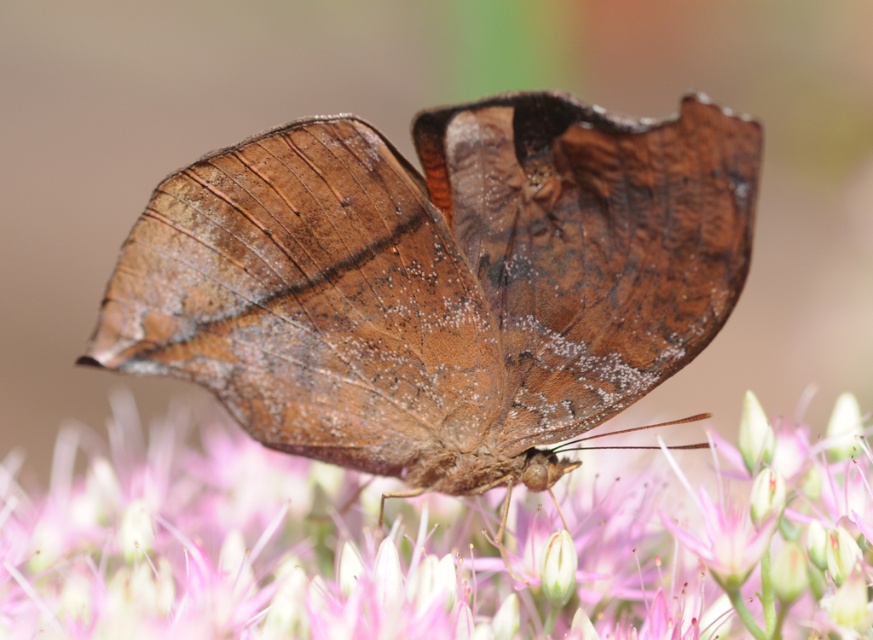
You are a photographer trying to capture the pink fuzzy flower at center without the brown matte butterfly at center blocking it. Based on the scene, is the flower visible behind the butterfly?

The pink fuzzy flower at center is behind the brown matte butterfly at center, so it might be partially visible but could be obscured by the butterfly depending on the angle and focus.

You are a photographer trying to capture the brown matte butterfly at center and the pink fuzzy flower at center in a single shot. Based on their sizes, which one will appear smaller in the photo?

The brown matte butterfly at center occupies less space than the pink fuzzy flower at center, so it will appear smaller in the photo.

You are a photographer trying to capture the butterfly on the flowers. You notice two points in the image at coordinates point (517,141) and point (12,552). Which point is closer to the camera?

Point (517,141) is in front of point (12,552), so the point (517,141) is closer to the camera.